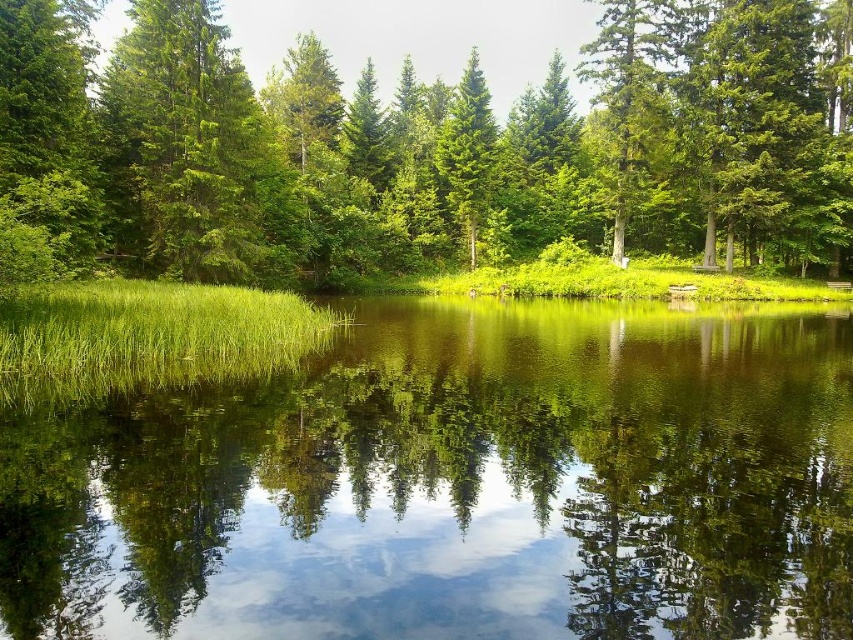
Question: Which of these objects is positioned farthest from the green grassy lake at center?

Choices:
 (A) green matte tree at center
 (B) green matte tree at left

Answer: (A)

Question: Considering the relative positions of green leafy tree at center and green matte tree at center in the image provided, where is green leafy tree at center located with respect to green matte tree at center?

Choices:
 (A) below
 (B) above

Answer: (A)

Question: Which is nearer to the green matte tree at left?

Choices:
 (A) green leafy tree at center
 (B) green matte tree at center

Answer: (A)

Question: Does green grassy lake at center appear on the right side of green matte tree at left?

Choices:
 (A) yes
 (B) no

Answer: (A)

Question: Which point is farther to the camera?

Choices:
 (A) (460, 208)
 (B) (393, 156)

Answer: (B)

Question: Observing the image, what is the correct spatial positioning of green matte tree at left in reference to green matte tree at center?

Choices:
 (A) left
 (B) right

Answer: (A)